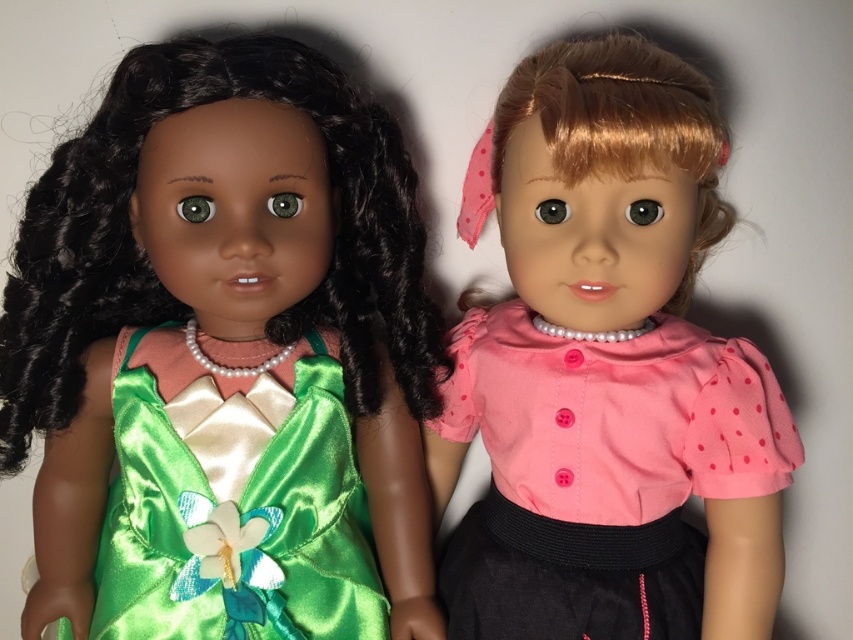
Question: Among these points, which one is nearest to the camera?

Choices:
 (A) (125, 401)
 (B) (128, 403)
 (C) (660, 404)

Answer: (C)

Question: Which object is positioned closest to the pink satin blouse at center?

Choices:
 (A) green satin dress at left
 (B) green satin dress at center

Answer: (A)

Question: Does green satin dress at left have a larger size compared to green satin dress at center?

Choices:
 (A) no
 (B) yes

Answer: (B)

Question: Can you confirm if green satin dress at left is bigger than pink satin blouse at center?

Choices:
 (A) yes
 (B) no

Answer: (A)

Question: Which point is closer to the camera taking this photo?

Choices:
 (A) (299, 401)
 (B) (712, 163)

Answer: (B)

Question: Can you confirm if green satin dress at left is smaller than pink satin blouse at center?

Choices:
 (A) no
 (B) yes

Answer: (A)